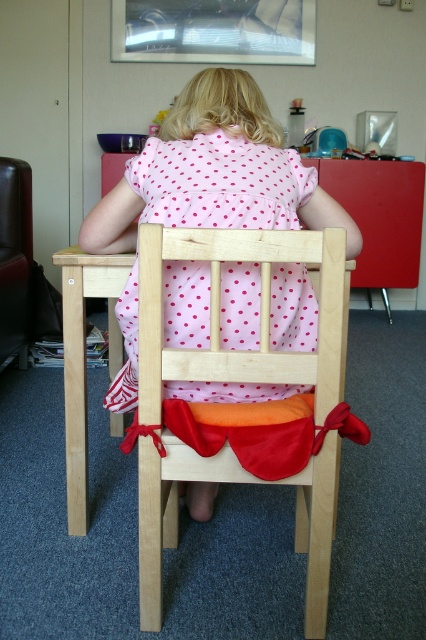
Based on the photo, you are a photographer standing in front of the wooden chair at center and want to take a closeup shot of it. The camera you are using has a minimum focusing distance of 1 meter. Can you take the photo without moving closer?

The wooden chair at center is 1.07 meters away from camera, so yes, you can take the photo without moving closer because the distance is within the camera minimum focusing distance of 1 meter.

You are a parent trying to choose between two items to pack for a picnic. You have the wooden chair at center and the pink dotted fabric dress at center. Which item takes up more space?

The wooden chair at center is bigger than the pink dotted fabric dress at center, so it takes up more space.

You are a photographer standing 1.07 meters away from the wooden chair at center. You want to take a photo of the child sitting at the table. Will you need to move closer or farther away to get the child in focus?

The wooden chair at center is 1.07 meters away from the camera. Since the child is sitting at the table behind the chair, you would need to move slightly farther away to ensure the entire child and the chair are in focus.